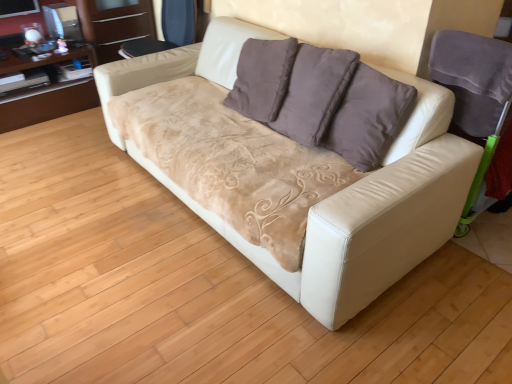
Question: Is white leather armchair at right, which appears as the 1th armchair when ordered from the bottom, in front of brown wood dresser at upper left, which ranks as the first dresser in left-to-right order?

Choices:
 (A) yes
 (B) no

Answer: (A)

Question: Can you confirm if white leather armchair at right, the second armchair when ordered from left to right, is positioned to the left of brown wood dresser at upper left, which ranks as the first dresser in left-to-right order?

Choices:
 (A) yes
 (B) no

Answer: (B)

Question: Considering the relative sizes of white leather armchair at right, the second armchair positioned from the top, and brown wood dresser at upper left, the 2th dresser positioned from the right, in the image provided, is white leather armchair at right, the second armchair positioned from the top, thinner than brown wood dresser at upper left, the 2th dresser positioned from the right,?

Choices:
 (A) no
 (B) yes

Answer: (B)

Question: From the image's perspective, is white leather armchair at right, which appears as the 1th armchair when viewed from the front, beneath brown wood dresser at upper left, which ranks as the first dresser in left-to-right order?

Choices:
 (A) yes
 (B) no

Answer: (A)

Question: Can you confirm if white leather armchair at right, which appears as the 1th armchair when viewed from the front, is bigger than brown wood dresser at upper left, the 2th dresser positioned from the right?

Choices:
 (A) yes
 (B) no

Answer: (B)

Question: Is white leather couch at center taller or shorter than brown wood dresser at upper left, which ranks as the first dresser in left-to-right order?

Choices:
 (A) tall
 (B) short

Answer: (A)

Question: Do you think white leather couch at center is within brown wood dresser at upper left, the 2th dresser positioned from the right, or outside of it?

Choices:
 (A) inside
 (B) outside

Answer: (B)

Question: Visually, is white leather couch at center positioned to the left or to the right of brown wood dresser at upper left, which ranks as the first dresser in left-to-right order?

Choices:
 (A) right
 (B) left

Answer: (A)

Question: Looking at the image, does white leather couch at center seem bigger or smaller compared to brown wood dresser at upper left, the 2th dresser positioned from the right?

Choices:
 (A) small
 (B) big

Answer: (B)

Question: Is point (165, 11) closer or farther from the camera than point (432, 114)?

Choices:
 (A) farther
 (B) closer

Answer: (A)

Question: Is velvet dark blue armchair at upper center, which ranks as the 1th armchair in top-to-bottom order, taller or shorter than white leather couch at center?

Choices:
 (A) tall
 (B) short

Answer: (B)

Question: From a real-world perspective, relative to white leather couch at center, is velvet dark blue armchair at upper center, which ranks as the 1th armchair in back-to-front order, vertically above or below?

Choices:
 (A) below
 (B) above

Answer: (B)

Question: In terms of width, does velvet dark blue armchair at upper center, the 2th armchair positioned from the right, look wider or thinner when compared to white leather couch at center?

Choices:
 (A) thin
 (B) wide

Answer: (A)

Question: In terms of width, does white leather couch at center look wider or thinner when compared to matte brown wood dresser at upper left, which is counted as the 2th dresser, starting from the left?

Choices:
 (A) wide
 (B) thin

Answer: (A)

Question: In the image, is white leather couch at center positioned in front of or behind matte brown wood dresser at upper left, which is counted as the 2th dresser, starting from the left?

Choices:
 (A) front
 (B) behind

Answer: (A)